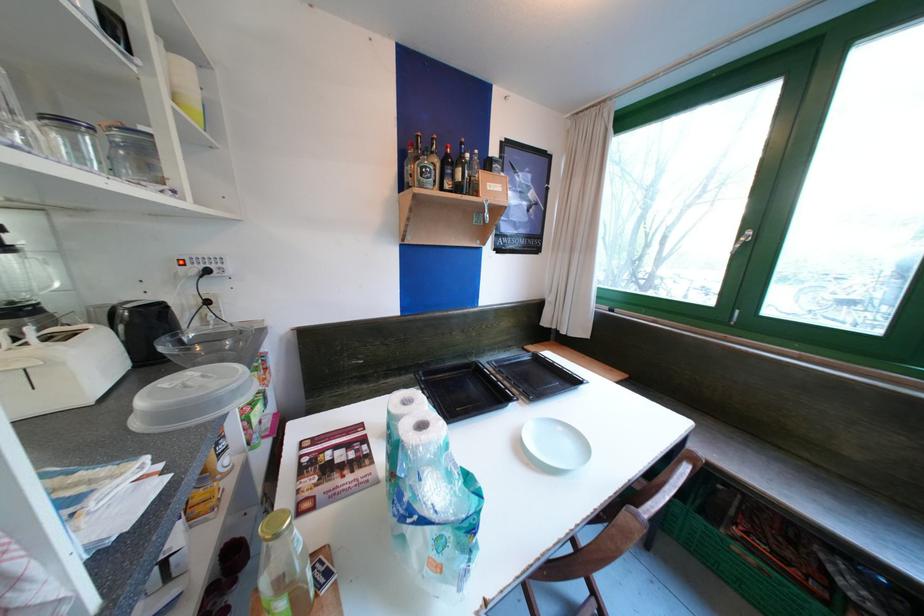
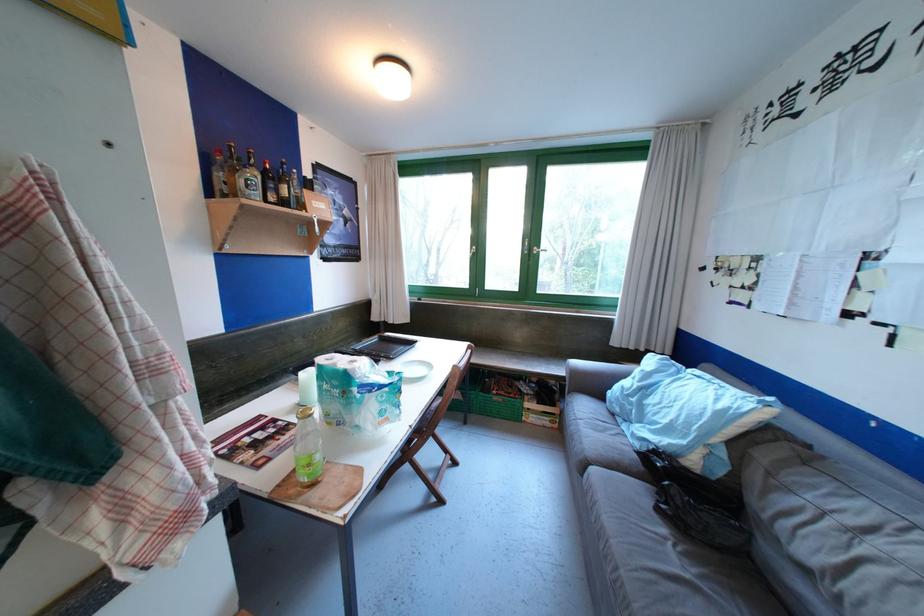
Find the pixel in the second image that matches point (506, 350) in the first image.

(348, 349)